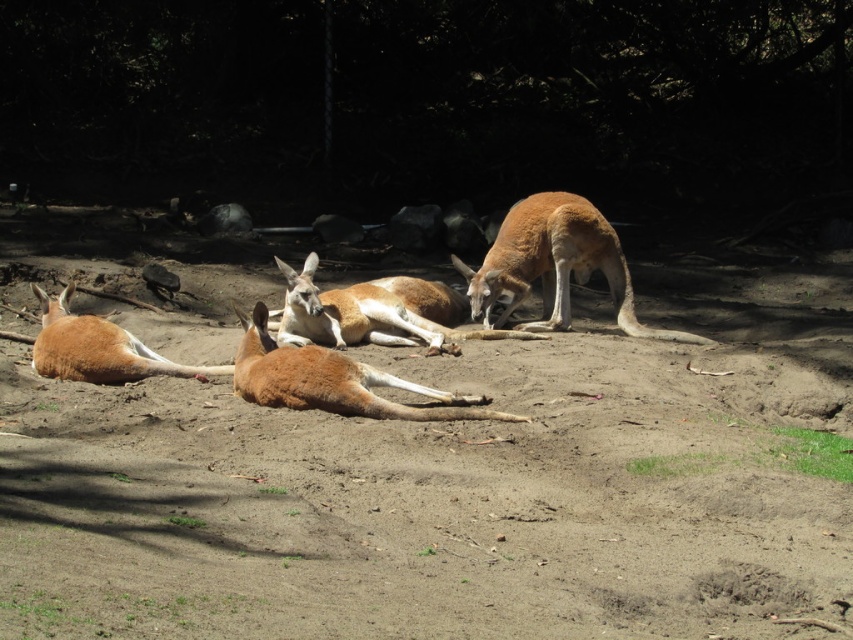
Question: Is brown sandy ground at center closer to camera compared to brown fur kangaroo at center?

Choices:
 (A) yes
 (B) no

Answer: (A)

Question: Which point is closer to the camera?

Choices:
 (A) brown sandy ground at center
 (B) matte brown kangaroo at lower left
 (C) smooth brown kangaroo at center

Answer: (A)

Question: Which is farther from the smooth brown kangaroo at center?

Choices:
 (A) matte brown kangaroo at lower left
 (B) brown furry kangaroo at center
 (C) brown sandy ground at center
 (D) brown fur kangaroo at center

Answer: (C)

Question: Which of the following is the closest to the observer?

Choices:
 (A) click(109, 436)
 (B) click(79, 320)
 (C) click(508, 221)

Answer: (A)

Question: Can you confirm if brown sandy ground at center is positioned above smooth brown kangaroo at center?

Choices:
 (A) no
 (B) yes

Answer: (A)

Question: Does brown sandy ground at center have a greater width compared to matte brown kangaroo at lower left?

Choices:
 (A) no
 (B) yes

Answer: (A)